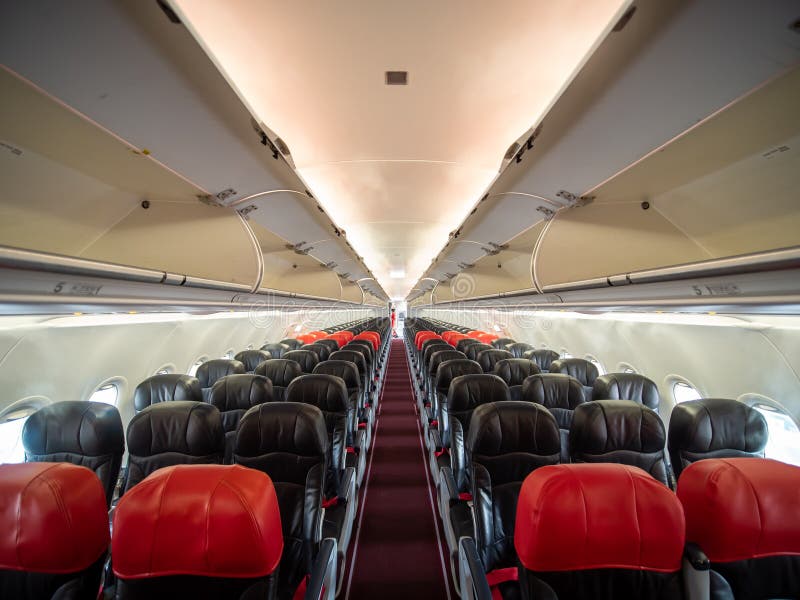
What are the coordinates of `staorage compartments` in the screenshot? It's located at (148, 230), (302, 261), (356, 289), (506, 274), (634, 261).